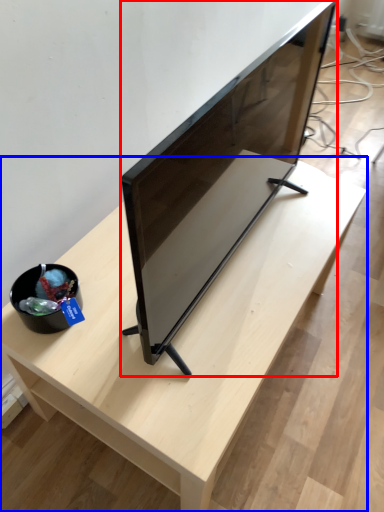
Question: Which object appears farthest to the camera in this image, television (highlighted by a red box) or table (highlighted by a blue box)?

Choices:
 (A) television
 (B) table

Answer: (B)